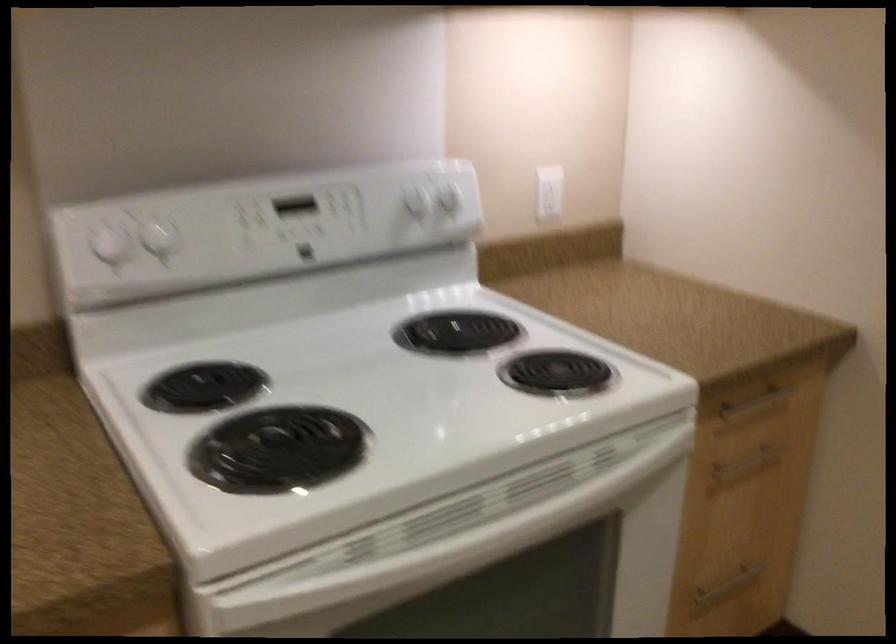
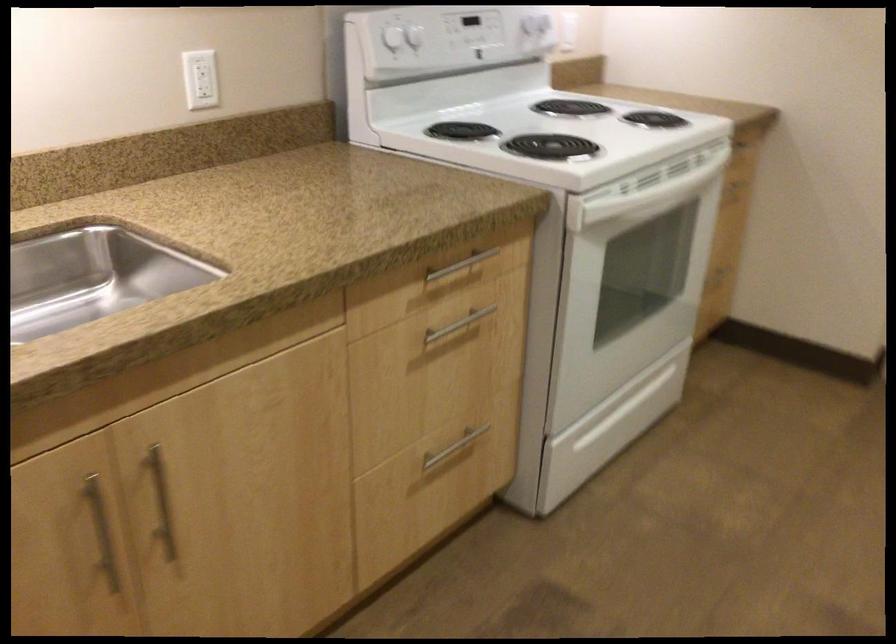
Find the pixel in the second image that matches pixel 170 232 in the first image.

(414, 37)